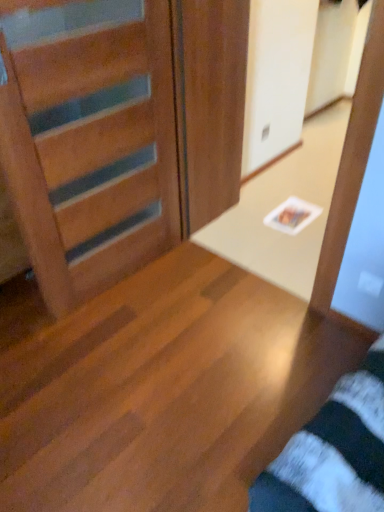
What do you see at coordinates (118, 130) in the screenshot?
I see `wooden door at center` at bounding box center [118, 130].

Find the location of a particular element. The width and height of the screenshot is (384, 512). wooden door at center is located at coordinates (118, 130).

The width and height of the screenshot is (384, 512). Identify the location of wooden door at center. (118, 130).